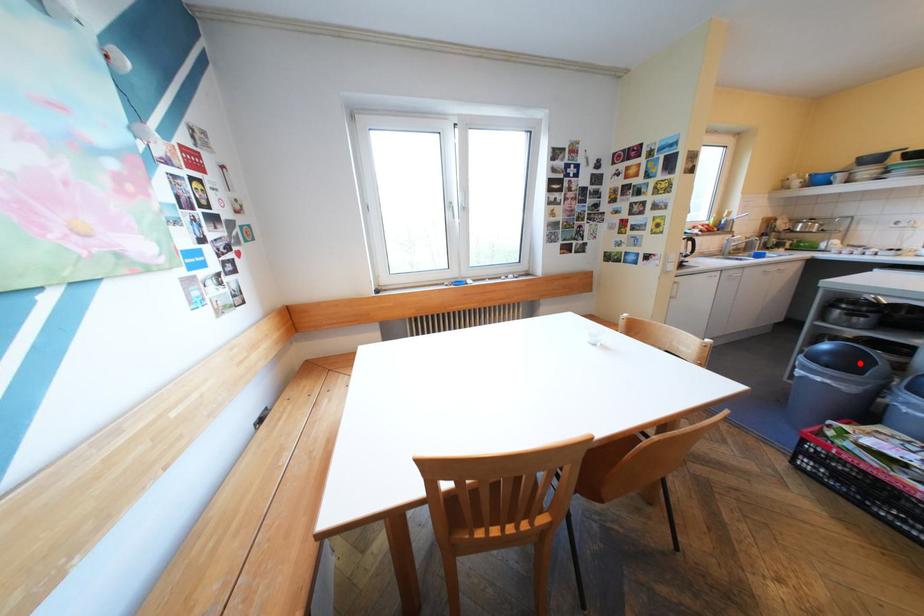
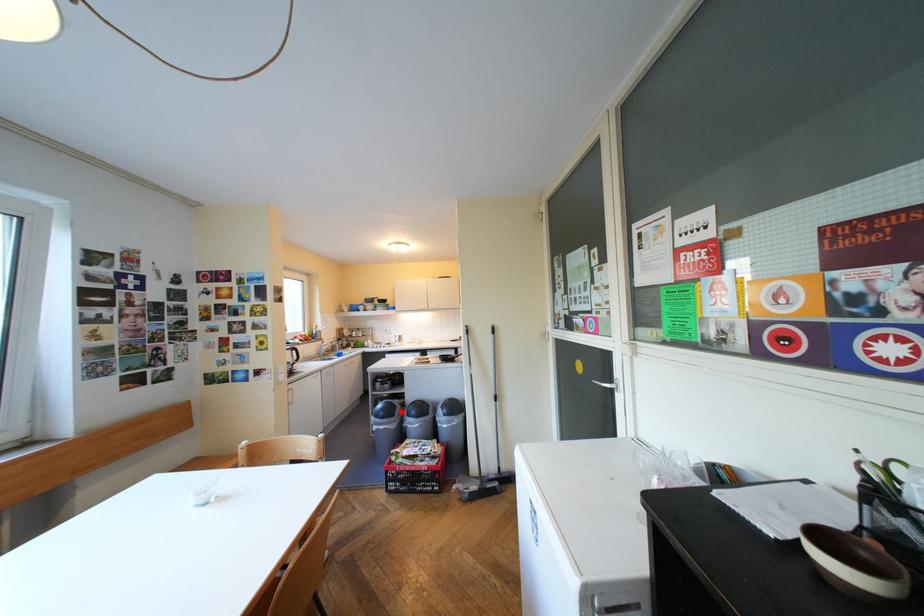
I am providing you with two images of the same scene from different viewpoints. A red point is marked on the first image and another point is marked on the second image. Does the point marked in image1 correspond to the same location as the one in image2?

Yes